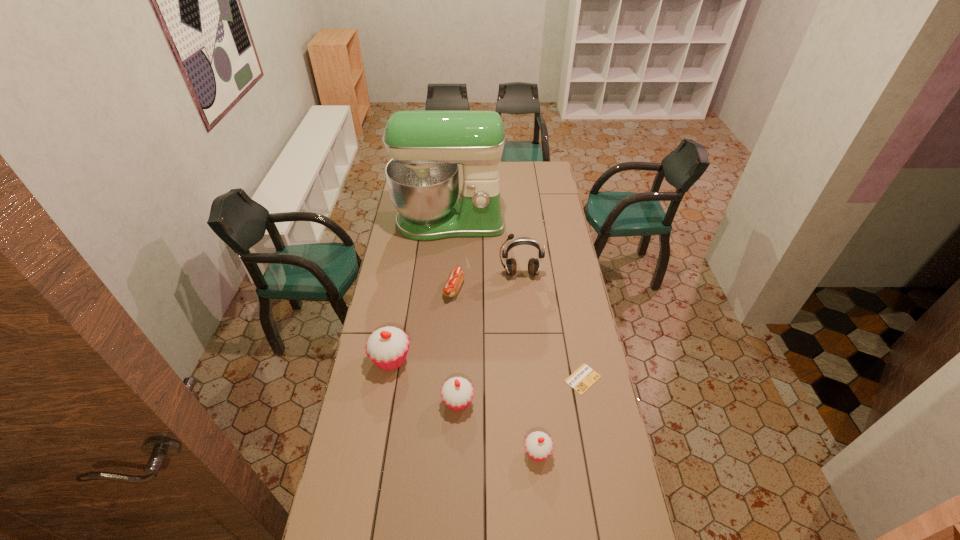
This screenshot has width=960, height=540. I want to click on mixer that is at the left edge, so click(426, 147).

The height and width of the screenshot is (540, 960). I want to click on object at the right edge, so click(x=584, y=377).

Where is `vacant space at the far edge`? This screenshot has width=960, height=540. vacant space at the far edge is located at coordinates (524, 162).

Image resolution: width=960 pixels, height=540 pixels. In order to click on vacant space at the near edge in this screenshot , I will do `click(468, 515)`.

Locate an element on the screen. The image size is (960, 540). vacant space at the left edge of the desktop is located at coordinates (334, 492).

This screenshot has width=960, height=540. Find the location of `vacant region at the right edge of the desktop`. vacant region at the right edge of the desktop is located at coordinates point(542,186).

Identify the location of blank region between the tallest object and the sausage. This screenshot has width=960, height=540. (452, 256).

Find the location of a particular element. The height and width of the screenshot is (540, 960). free point between the tallest object and the rightmost object is located at coordinates (516, 301).

Locate an element on the screen. This screenshot has width=960, height=540. vacant space that is in between the tallest object and the second cupcake from left to right is located at coordinates (454, 312).

The width and height of the screenshot is (960, 540). What are the coordinates of `vacant space that's between the sausage and the rightmost object` in the screenshot? It's located at (518, 334).